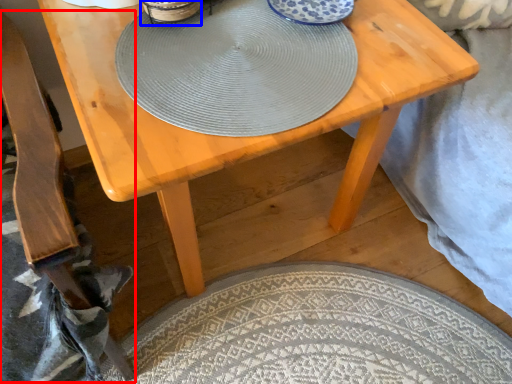
Question: Among these objects, which one is farthest to the camera, armchair (highlighted by a red box) or tableware (highlighted by a blue box)?

Choices:
 (A) armchair
 (B) tableware

Answer: (B)